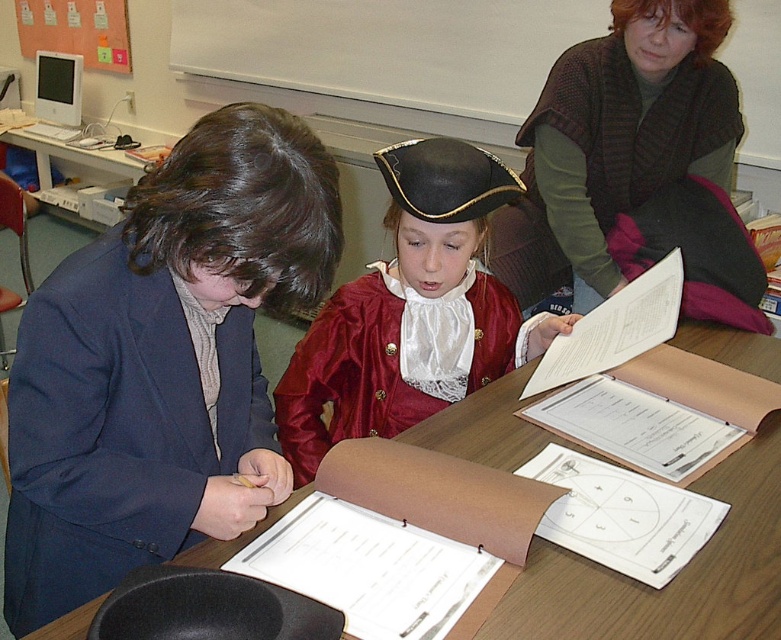
Does blue fabric jacket at left appear on the right side of wooden table at center?

No, blue fabric jacket at left is not to the right of wooden table at center.

Is point (81, 346) positioned before point (580, 637)?

Yes, it is in front of point (580, 637).

What do you see at coordinates (162, 362) in the screenshot? Image resolution: width=781 pixels, height=640 pixels. I see `blue fabric jacket at left` at bounding box center [162, 362].

Find the location of `blue fabric jacket at left`. blue fabric jacket at left is located at coordinates (162, 362).

From the picture: Is blue fabric jacket at left taller than shiny red coat at center?

Yes.

Between blue fabric jacket at left and shiny red coat at center, which one appears on the right side from the viewer's perspective?

From the viewer's perspective, shiny red coat at center appears more on the right side.

This screenshot has width=781, height=640. What do you see at coordinates (162, 362) in the screenshot?
I see `blue fabric jacket at left` at bounding box center [162, 362].

What are the coordinates of `blue fabric jacket at left` in the screenshot? It's located at (162, 362).

From the picture: Is blue fabric jacket at left positioned at the back of green sweater at upper right?

That is False.

Can you confirm if blue fabric jacket at left is taller than green sweater at upper right?

Yes, blue fabric jacket at left is taller than green sweater at upper right.

The image size is (781, 640). In order to click on blue fabric jacket at left in this screenshot , I will do `click(162, 362)`.